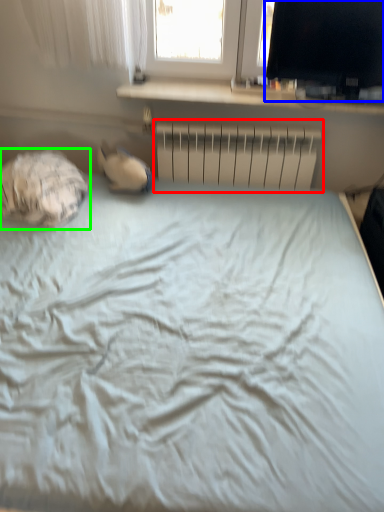
Question: Considering the real-world distances, which object is closest to radiator (highlighted by a red box)? computer monitor (highlighted by a blue box) or sleeping bag (highlighted by a green box).

Choices:
 (A) computer monitor
 (B) sleeping bag

Answer: (A)